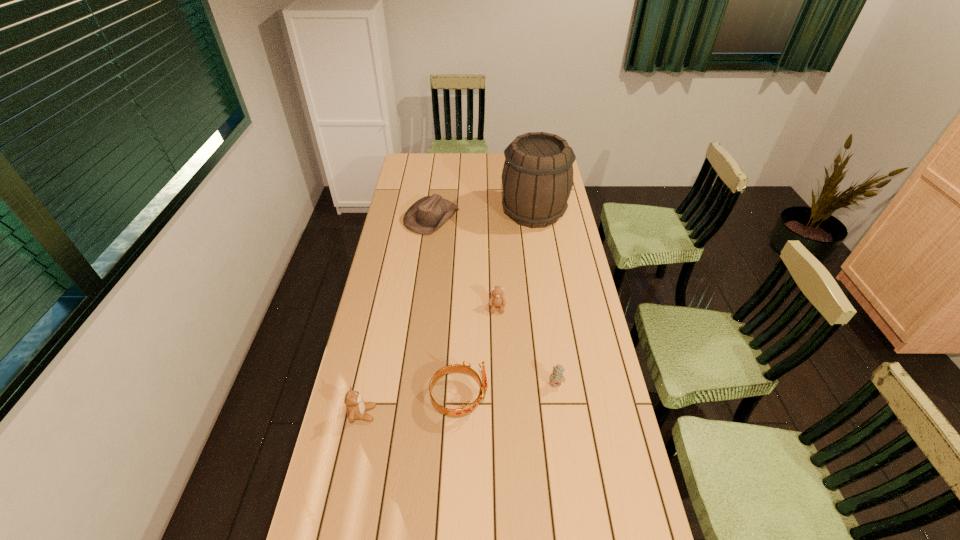
Locate an element on the screen. wine bucket is located at coordinates (537, 179).

Where is `the second tallest object`? The image size is (960, 540). the second tallest object is located at coordinates (468, 408).

Identify the location of the leftmost teddy bear. The width and height of the screenshot is (960, 540). (356, 408).

Locate an element on the screen. The height and width of the screenshot is (540, 960). the tallest teddy bear is located at coordinates (356, 408).

The width and height of the screenshot is (960, 540). In order to click on fedora in this screenshot , I will do `click(429, 213)`.

The height and width of the screenshot is (540, 960). What are the coordinates of `the farthest teddy bear` in the screenshot? It's located at (497, 299).

Identify the location of the third farthest object. (497, 299).

Identify the location of the second nearest teddy bear. The image size is (960, 540). (556, 377).

Where is `free space located 0.370m on the back of the wine bucket`? The width and height of the screenshot is (960, 540). free space located 0.370m on the back of the wine bucket is located at coordinates (525, 157).

At what (x,y) coordinates should I click in order to perform the action: click on vacant space situated on the front-facing side of the tiara. Please return your answer as a coordinate pair (x, y). The width and height of the screenshot is (960, 540). Looking at the image, I should click on (520, 398).